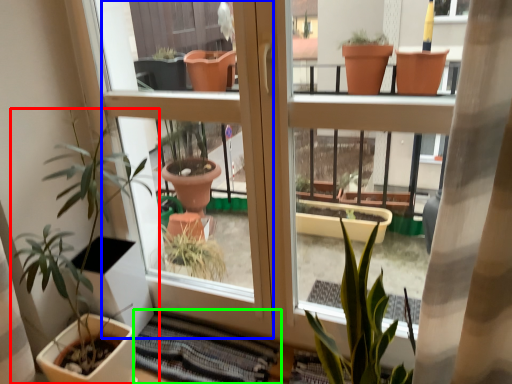
Question: Which object is positioned closest to houseplant (highlighted by a red box)? Select from screen door (highlighted by a blue box) and atrium (highlighted by a green box).

Choices:
 (A) screen door
 (B) atrium

Answer: (A)